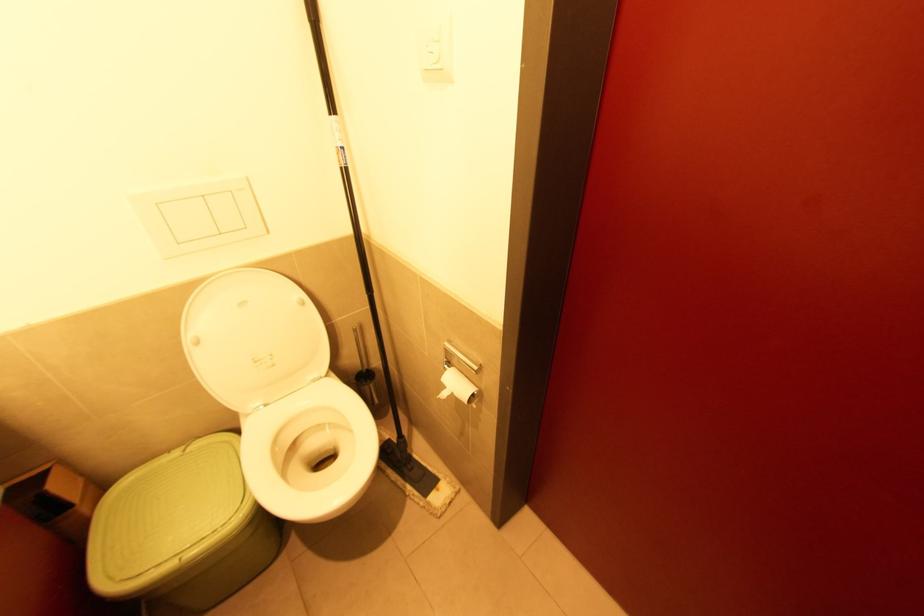
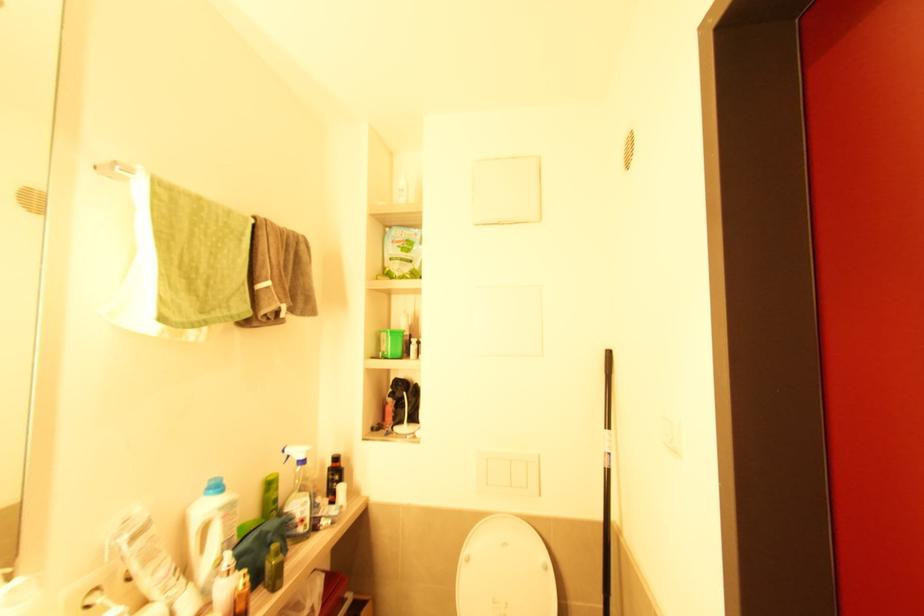
Locate, in the second image, the point that corresponds to [200,342] in the first image.

(469, 561)